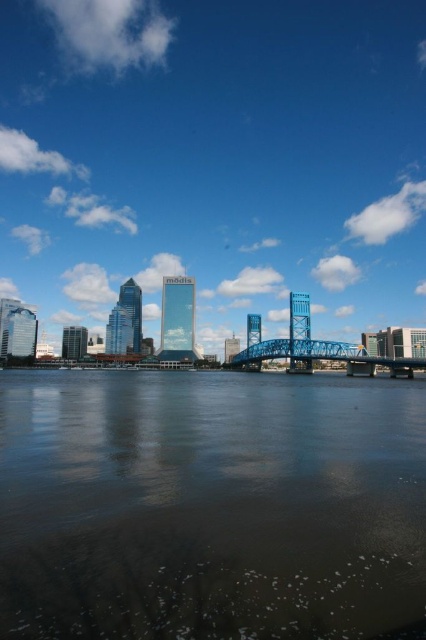
You are standing at the edge of the water in the cityscape image. There is a point marked at coordinates point (414, 58). Can you estimate how far this point is from your current position?

The point (414, 58) is 289.46 meters away from your current position.

You are standing on the shore of the waterway and want to cross to the other side. You see the transparent glass bridge at center and the brown reflective water at center. Which one is closer to your left side?

The transparent glass bridge at center is to the left of brown reflective water at center, so it is closer to your left side.

You are a drone operator planning to fly a drone from the transparent glass bridge at center to the brown reflective water at center. The drone has a maximum flight distance of 170 meters. Based on the scene, can the drone reach the water from the bridge?

The transparent glass bridge at center is 173.97 meters from the brown reflective water at center. Since the drone can only fly 170 meters, it cannot reach the water from the bridge.